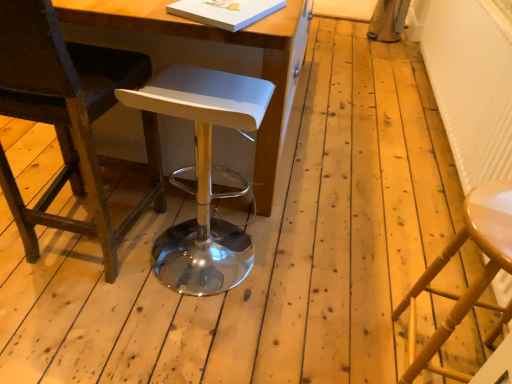
The height and width of the screenshot is (384, 512). What are the coordinates of `vacant area that lies to the right of white plastic stool at center, marked as the first stool in a left-to-right arrangement` in the screenshot? It's located at (296, 267).